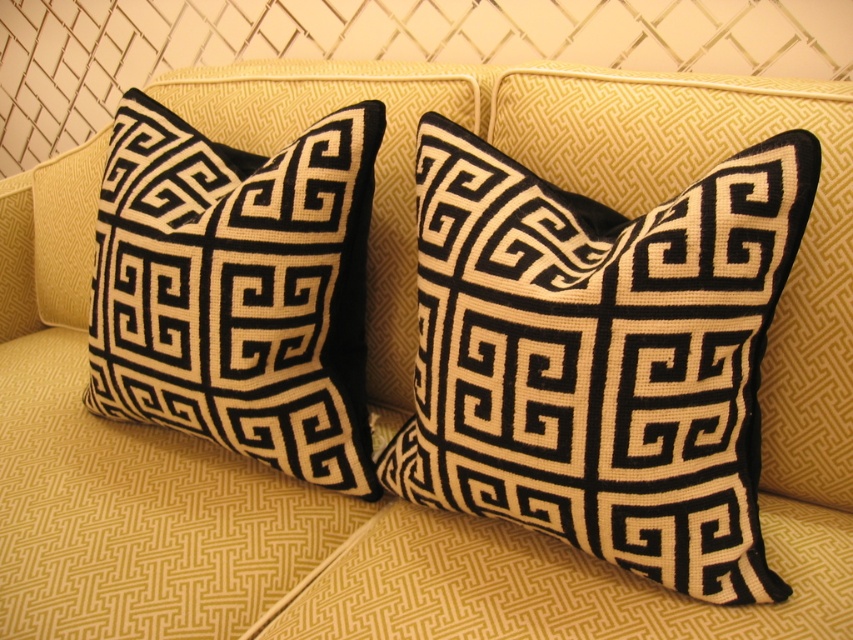
Question: Does black velvet pillow at center have a larger size compared to black velvet pillow at left?

Choices:
 (A) yes
 (B) no

Answer: (A)

Question: Can you confirm if black velvet pillow at center is positioned to the right of black velvet pillow at left?

Choices:
 (A) no
 (B) yes

Answer: (B)

Question: Does black velvet pillow at center appear under black velvet pillow at left?

Choices:
 (A) yes
 (B) no

Answer: (A)

Question: Which point is farther to the camera?

Choices:
 (A) (149, 268)
 (B) (726, 406)

Answer: (A)